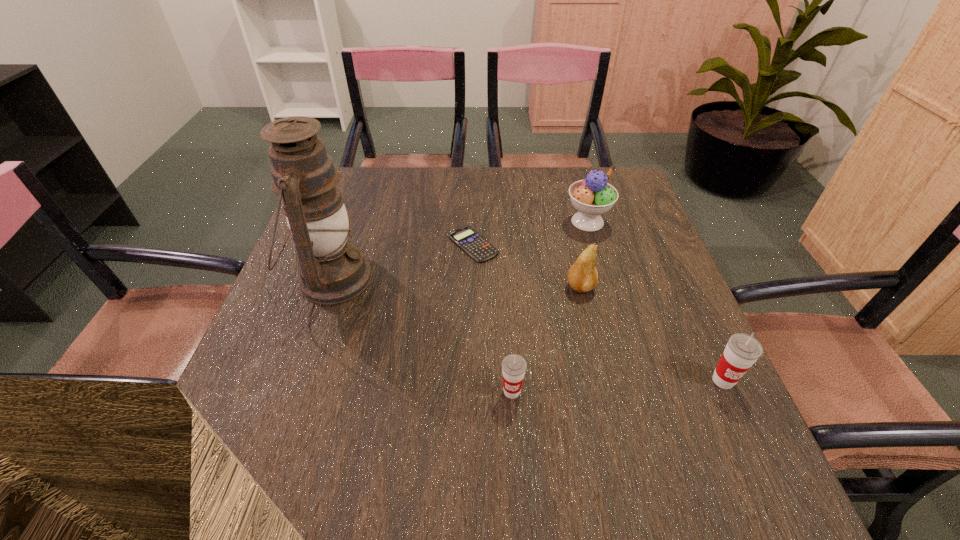
Find the location of a particular element. This screenshot has height=540, width=960. vacant region at the near edge is located at coordinates (338, 417).

Where is `vacant space at the left edge`? vacant space at the left edge is located at coordinates (264, 387).

Locate an element on the screen. free spot at the right edge of the desktop is located at coordinates (635, 232).

This screenshot has width=960, height=540. Find the location of `free space at the far right corner of the desktop`. free space at the far right corner of the desktop is located at coordinates (619, 198).

In the image, there is a desktop. Identify the location of vacant space at the near right corner. (691, 416).

At what (x,y) coordinates should I click in order to perform the action: click on free area in between the oil lamp and the shortest object. Please return your answer as a coordinate pair (x, y). This screenshot has height=540, width=960. Looking at the image, I should click on (402, 261).

Find the location of a particular element. The height and width of the screenshot is (540, 960). vacant area that lies between the icecream and the shortest object is located at coordinates (530, 233).

Locate an element on the screen. vacant point located between the oil lamp and the shortest object is located at coordinates (402, 261).

The image size is (960, 540). I want to click on blank region between the calculator and the tallest object, so click(x=402, y=261).

At what (x,y) coordinates should I click in order to perform the action: click on vacant region between the right cup and the leftmost object. Please return your answer as a coordinate pair (x, y). Looking at the image, I should click on (528, 330).